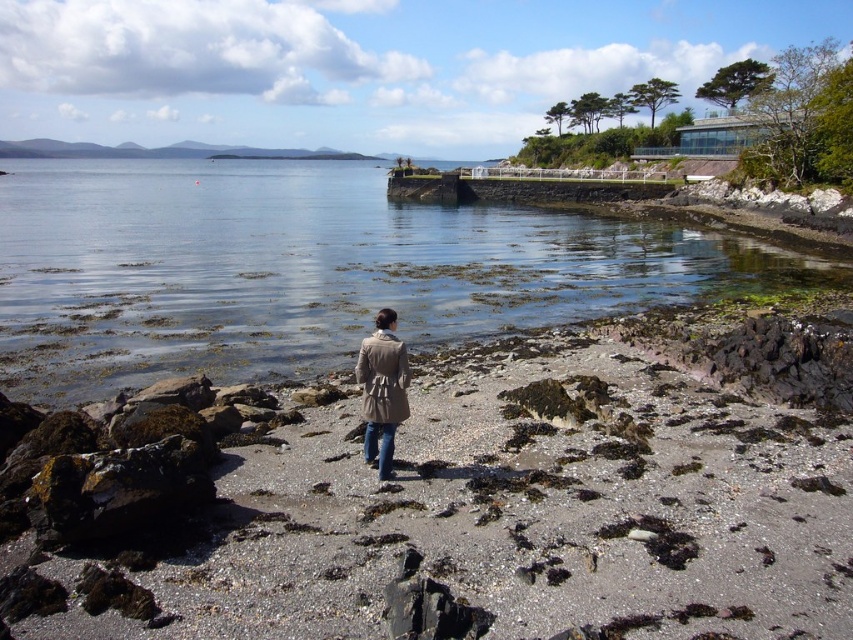
From the picture: Is smooth sand beach at center closer to camera compared to tan textured trench coat at center?

Yes.

Does smooth sand beach at center appear on the right side of tan textured trench coat at center?

Yes, smooth sand beach at center is to the right of tan textured trench coat at center.

Is point (318, 580) positioned in front of point (380, 410)?

Yes, point (318, 580) is in front of point (380, 410).

Image resolution: width=853 pixels, height=640 pixels. I want to click on smooth sand beach at center, so click(467, 497).

Measure the distance between tan textured trench coat at center and blue denim jeans at center.

The distance of tan textured trench coat at center from blue denim jeans at center is 18.68 inches.

Between tan textured trench coat at center and blue denim jeans at center, which one is positioned lower?

blue denim jeans at center

The width and height of the screenshot is (853, 640). What do you see at coordinates (383, 378) in the screenshot?
I see `tan textured trench coat at center` at bounding box center [383, 378].

Locate an element on the screen. Image resolution: width=853 pixels, height=640 pixels. tan textured trench coat at center is located at coordinates (383, 378).

Can you confirm if smooth sand beach at center is bigger than clear water at center?

No.

Is smooth sand beach at center to the right of clear water at center from the viewer's perspective?

Correct, you'll find smooth sand beach at center to the right of clear water at center.

Between point (329, 612) and point (392, 273), which one is positioned in front?

Positioned in front is point (329, 612).

Locate an element on the screen. smooth sand beach at center is located at coordinates (467, 497).